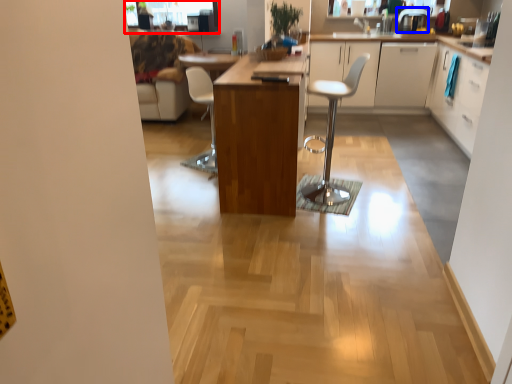
Question: Which object is further to the camera taking this photo, window screen (highlighted by a red box) or appliance (highlighted by a blue box)?

Choices:
 (A) window screen
 (B) appliance

Answer: (A)